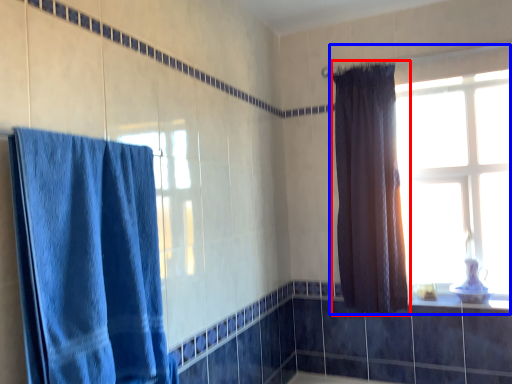
Question: Which point is further to the camera, curtain (highlighted by a red box) or window (highlighted by a blue box)?

Choices:
 (A) curtain
 (B) window

Answer: (B)